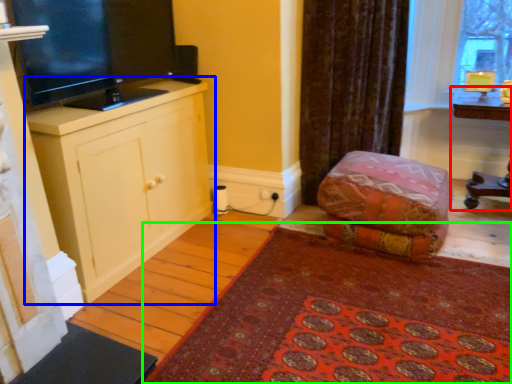
Question: Based on their relative distances, which object is nearer to table (highlighted by a red box)? Choose from cabinetry (highlighted by a blue box) and mat (highlighted by a green box).

Choices:
 (A) cabinetry
 (B) mat

Answer: (B)